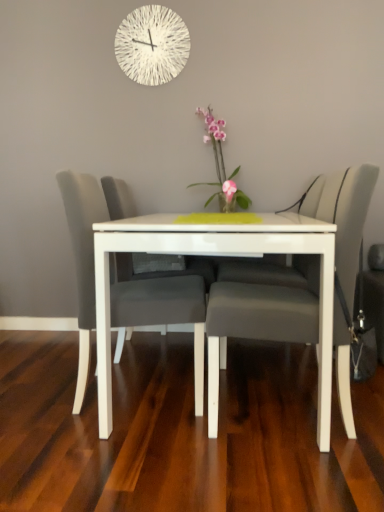
Where is `free space in front of matte gray chair at center, the first chair viewed from the left`? The height and width of the screenshot is (512, 384). free space in front of matte gray chair at center, the first chair viewed from the left is located at coordinates (116, 462).